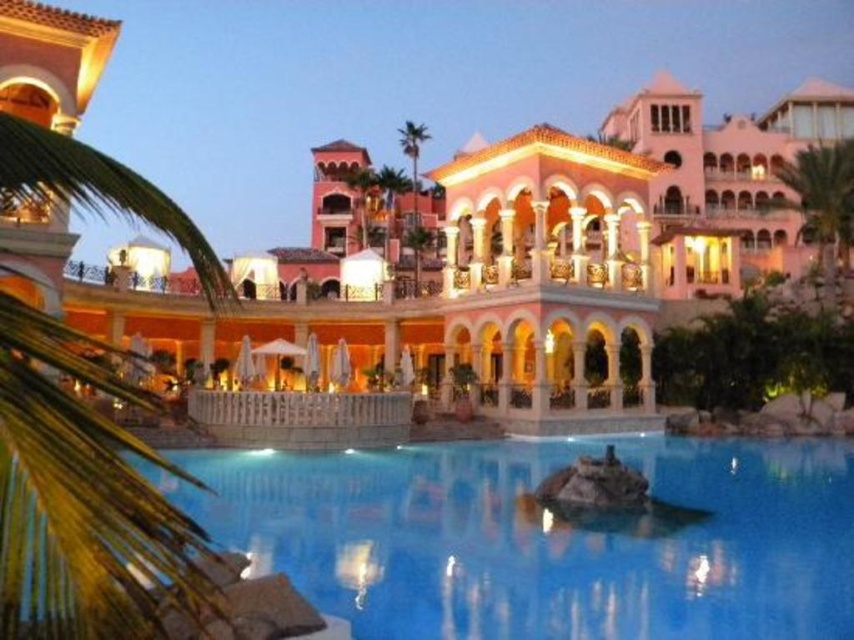
You are a guest staying at the resort and want to take a photo of the clear glass pool at center with the green leafy palm tree at upper right in the background. Can you position yourself in a way that the palm tree appears behind the pool in the photo?

Yes, because the clear glass pool at center is positioned under the green leafy palm tree at upper right, so standing in front of the pool would allow the palm tree to be captured behind it in the photo.

You are a drone operator tasked with capturing aerial footage of the resort. Your drone has a maximum flight range of 50 meters. From your current position, you need to fly the drone to the clear glass pool at center and then to the green leafy palm tree at center. Can the drone complete this entire flight path without exceeding its range?

The distance between the clear glass pool at center and the green leafy palm tree at center is 52.98 meters, which exceeds the drone operator maximum flight range of 50 meters. Therefore, the drone cannot complete the entire flight path without exceeding its range.

You are standing at the edge of the pool and want to walk directly to the green leafy palm tree at center. However, there is a green leafy palm tree at upper right in your path. Will you need to go around it?

The green leafy palm tree at upper right is 70.97 meters away from the green leafy palm tree at center. Since the distance between them is quite large, you can walk directly to the green leafy palm tree at center without needing to go around the green leafy palm tree at upper right.